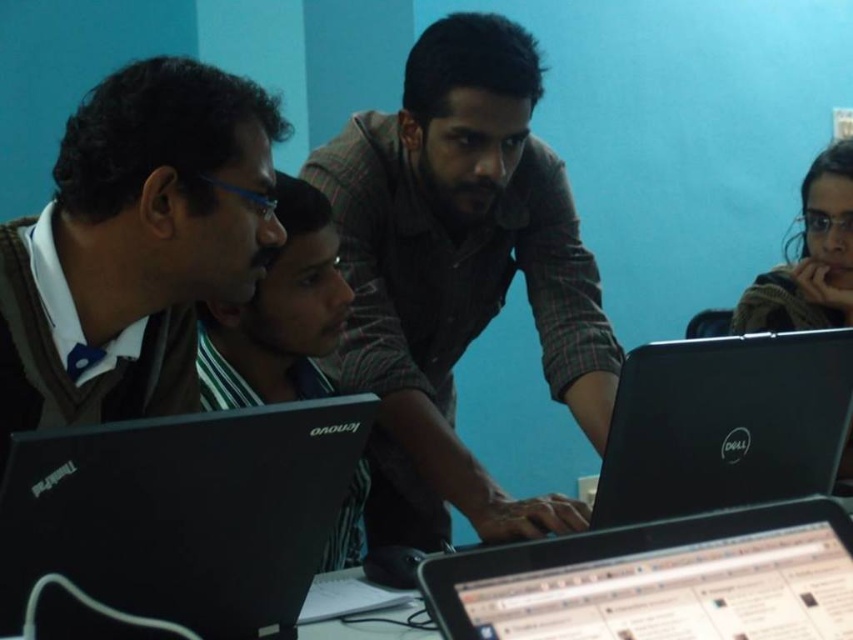
Question: From the image, what is the correct spatial relationship of black matte laptop at lower left in relation to black matte laptop at right?

Choices:
 (A) right
 (B) left

Answer: (B)

Question: Which point is closer to the camera taking this photo?

Choices:
 (A) (724, 525)
 (B) (123, 404)
 (C) (189, 548)

Answer: (A)

Question: Is black matte laptop at lower left wider than dark brown sweater at upper right?

Choices:
 (A) yes
 (B) no

Answer: (A)

Question: Which of the following is the closest to the observer?

Choices:
 (A) black matte laptop at right
 (B) plaid shirt at center
 (C) black matte laptop at lower left
 (D) black striped shirt at center

Answer: (C)

Question: Does matte brown sweater at left have a larger size compared to dark brown sweater at upper right?

Choices:
 (A) yes
 (B) no

Answer: (A)

Question: Which of the following is the closest to the observer?

Choices:
 (A) black matte laptop at right
 (B) dark brown sweater at upper right
 (C) plaid shirt at center

Answer: (A)